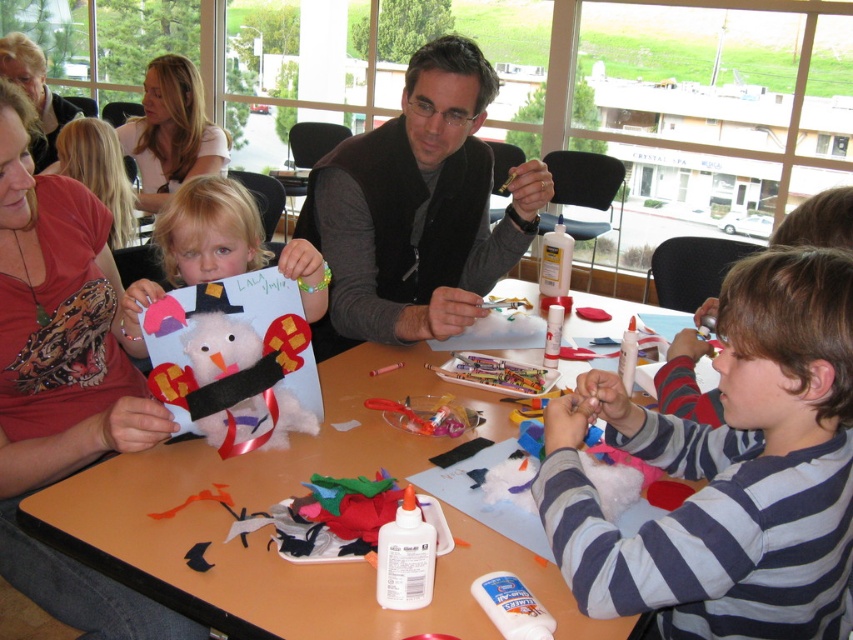
You are organizing a community craft event and need to display two items on a shelf. The striped cotton shirt at center and the black vest at center must be placed side by side. Which item should be placed on the left to ensure the shorter one is on the left side?

The striped cotton shirt at center should be placed on the left side because it is shorter than the black vest at center.

You are organizing a community event and need to arrange two items on a table. You have a black vest at center and a matte red shirt at upper left. According to the scene, where should you place each item to match their original positions?

Place the matte red shirt at upper left on the upper left side of the table and the black vest at center in the center to the right of the matte red shirt at upper left.

You are a photographer standing at the edge of the table where the striped cotton shirt at center is located. You want to take a photo of the shirt without any obstructions. Based on its position, where should you aim your camera to capture it clearly?

The striped cotton shirt at center is located at point 2D coordinates of (728, 472). To capture it clearly, aim your camera towards that coordinate position to ensure it is centered in the frame without any obstructions.